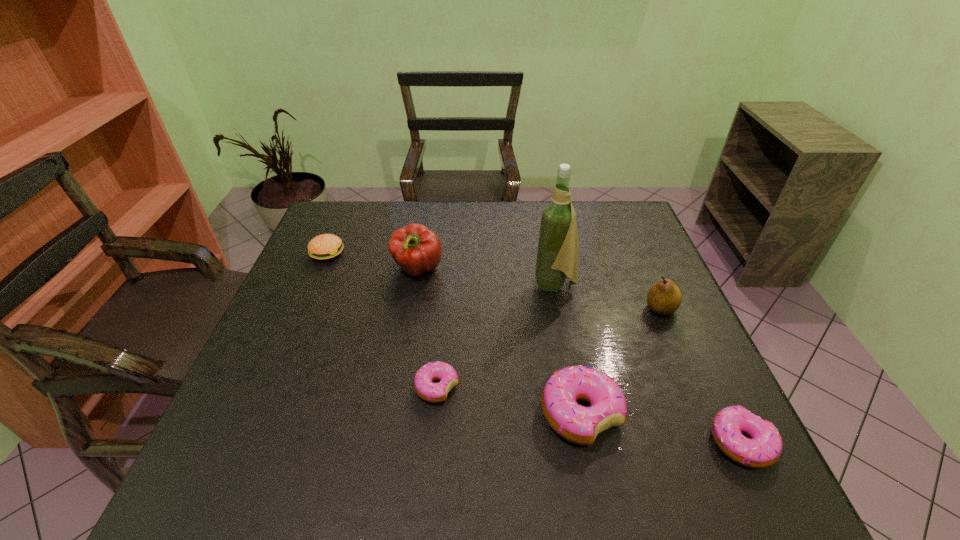
I want to click on doughnut located at the right edge, so click(764, 448).

You are a GUI agent. You are given a task and a screenshot of the screen. Output one action in this format:
    pyautogui.click(x=<x>, y=<y>)
    Task: Click on the pear at the right edge
    The image size is (960, 540).
    Given the screenshot: What is the action you would take?
    pyautogui.click(x=664, y=297)

Where is `object at the far left corner`? The width and height of the screenshot is (960, 540). object at the far left corner is located at coordinates (326, 246).

Locate an element on the screen. object located in the near right corner section of the desktop is located at coordinates (764, 448).

In order to click on vacant space at the far edge of the desktop in this screenshot , I will do `click(451, 209)`.

Where is `free space at the near edge of the desktop`? free space at the near edge of the desktop is located at coordinates (453, 414).

Where is `vacant region at the left edge of the desktop`? This screenshot has height=540, width=960. vacant region at the left edge of the desktop is located at coordinates (284, 308).

I want to click on free region at the right edge of the desktop, so click(x=667, y=332).

In the image, there is a desktop. Where is `vacant space at the far left corner`? vacant space at the far left corner is located at coordinates (354, 231).

The width and height of the screenshot is (960, 540). I want to click on blank space at the far right corner, so click(612, 234).